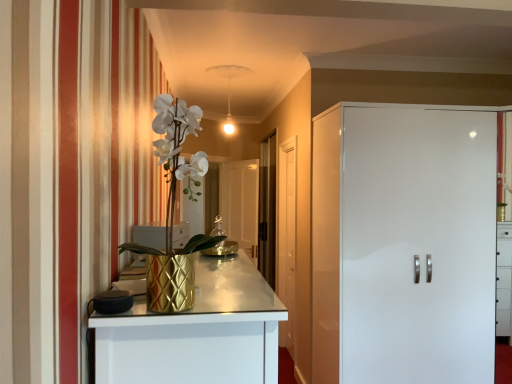
Question: In which direction should I rotate to look at transparent glass door at center, acting as the first glass door starting from the right?

Choices:
 (A) right
 (B) left

Answer: (A)

Question: Could you tell me if transparent glass door at center, the second glass door in the right-to-left sequence, is turned towards gold textured vase at left?

Choices:
 (A) no
 (B) yes

Answer: (A)

Question: Is transparent glass door at center, the 1th glass door positioned from the left, further to camera compared to gold textured vase at left?

Choices:
 (A) no
 (B) yes

Answer: (B)

Question: Can you confirm if transparent glass door at center, the second glass door in the right-to-left sequence, is positioned to the right of gold textured vase at left?

Choices:
 (A) yes
 (B) no

Answer: (A)

Question: Is transparent glass door at center, the second glass door in the right-to-left sequence, looking in the opposite direction of gold textured vase at left?

Choices:
 (A) yes
 (B) no

Answer: (B)

Question: Is transparent glass door at center, the 1th glass door positioned from the left, not near gold textured vase at left?

Choices:
 (A) yes
 (B) no

Answer: (A)

Question: From a real-world perspective, is transparent glass door at center, the second glass door in the right-to-left sequence, below gold textured vase at left?

Choices:
 (A) no
 (B) yes

Answer: (B)

Question: Does gold textured vase at left have a lesser height compared to transparent glass door at center, the 1th glass door positioned from the left?

Choices:
 (A) no
 (B) yes

Answer: (B)

Question: From a real-world perspective, is gold textured vase at left over transparent glass door at center, the 1th glass door positioned from the left?

Choices:
 (A) no
 (B) yes

Answer: (B)

Question: Is gold textured vase at left bigger than transparent glass door at center, the second glass door in the right-to-left sequence?

Choices:
 (A) yes
 (B) no

Answer: (B)

Question: From the image's perspective, is gold textured vase at left under transparent glass door at center, the second glass door in the right-to-left sequence?

Choices:
 (A) yes
 (B) no

Answer: (B)

Question: Does gold textured vase at left appear on the right side of transparent glass door at center, the second glass door in the right-to-left sequence?

Choices:
 (A) yes
 (B) no

Answer: (B)

Question: Is gold textured vase at left at the left side of transparent glass door at center, the 1th glass door positioned from the left?

Choices:
 (A) yes
 (B) no

Answer: (A)

Question: Is gold textured vase at left turned away from white glossy cabinet at right, which appears as the 2th door when viewed from the back?

Choices:
 (A) no
 (B) yes

Answer: (A)